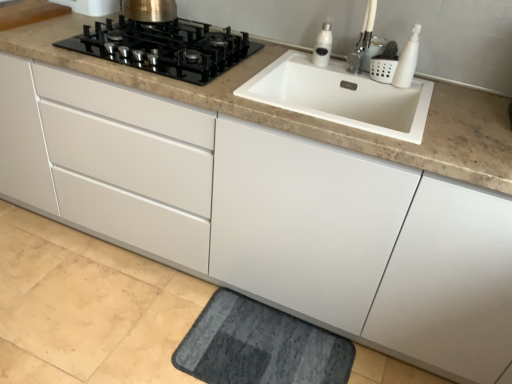
Where is `vacant region to the right of white matte soap dispenser at upper right, the 2th soap dispenser when ordered from back to front`? vacant region to the right of white matte soap dispenser at upper right, the 2th soap dispenser when ordered from back to front is located at coordinates (425, 86).